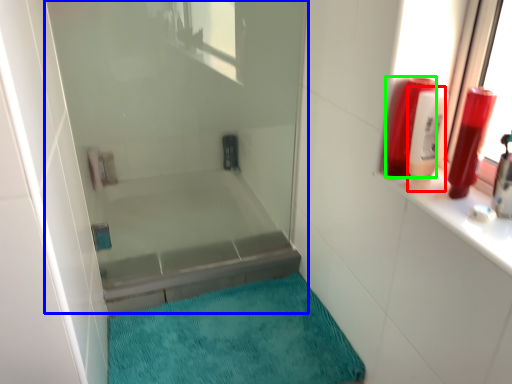
Question: Which is farther away from toiletry (highlighted by a red box)? shower door (highlighted by a blue box) or toiletry (highlighted by a green box)?

Choices:
 (A) shower door
 (B) toiletry

Answer: (A)